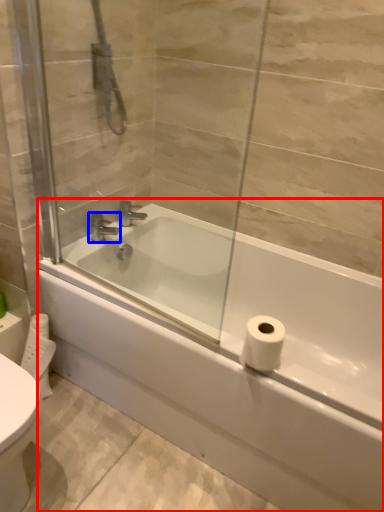
Question: Among these objects, which one is farthest to the camera, bathtub (highlighted by a red box) or tap (highlighted by a blue box)?

Choices:
 (A) bathtub
 (B) tap

Answer: (B)